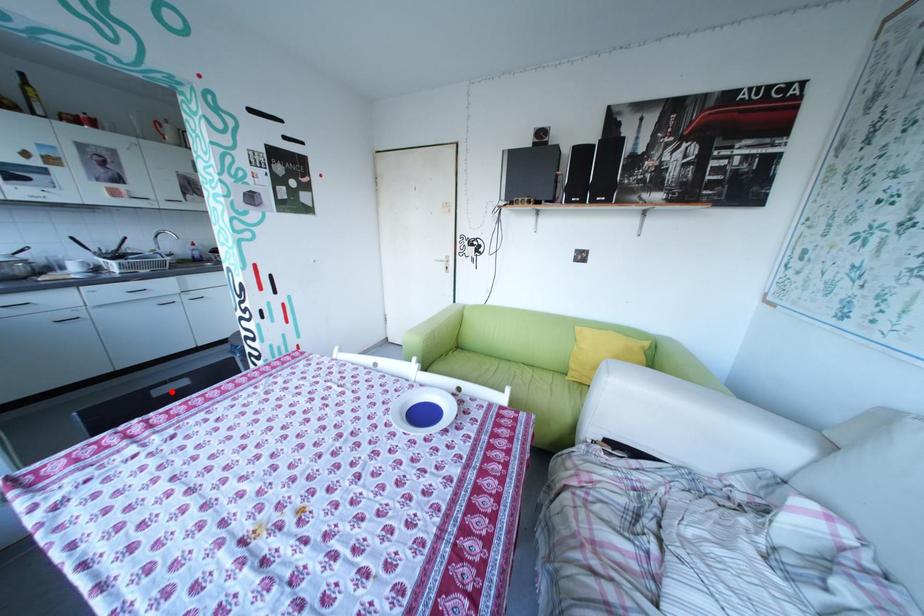
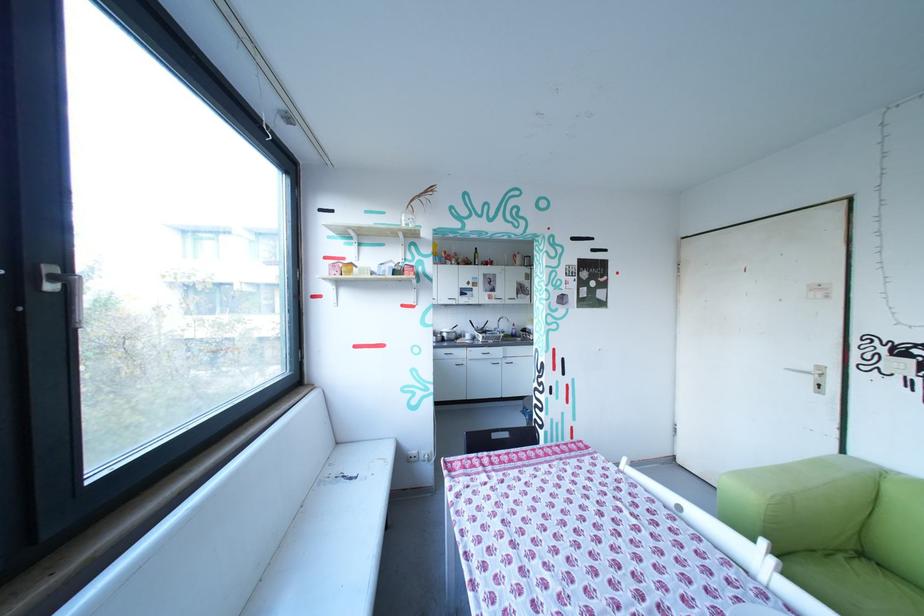
The point at the highlighted location is marked in the first image. Where is the corresponding point in the second image?

(507, 436)